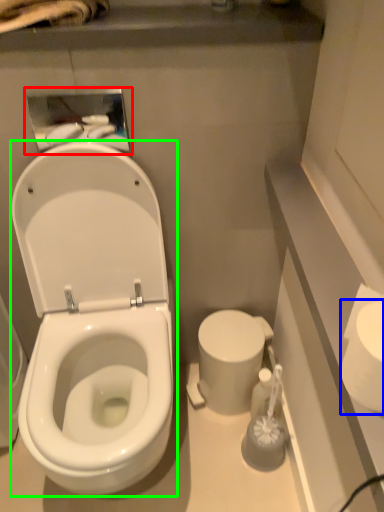
Question: Which object is positioned closest to medicine cabinet (highlighted by a red box)? Select from toilet paper (highlighted by a blue box) and wide (highlighted by a green box).

Choices:
 (A) toilet paper
 (B) wide

Answer: (B)